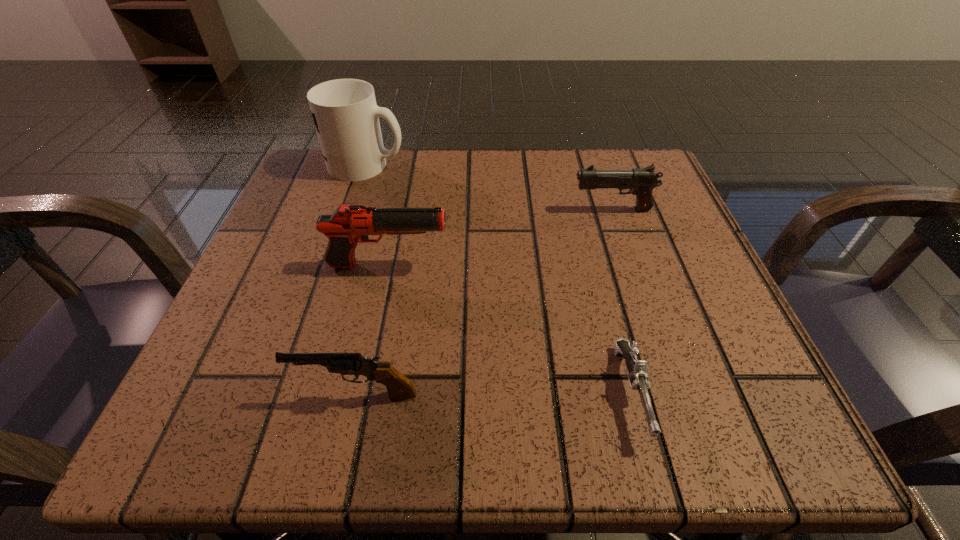
The image size is (960, 540). In order to click on the tallest object in this screenshot , I will do `click(346, 117)`.

I want to click on mug, so click(x=346, y=117).

Locate an element on the screen. This screenshot has height=540, width=960. the second farthest gun is located at coordinates (349, 225).

Identify the location of the second tallest object. (349, 225).

This screenshot has height=540, width=960. Find the location of `the fourth nearest object`. the fourth nearest object is located at coordinates (641, 182).

This screenshot has width=960, height=540. Find the location of `the shortest gun`. the shortest gun is located at coordinates (637, 369).

At what (x,y) coordinates should I click in order to perform the action: click on blank space located 0.260m on the handle side of the farthest object. Please return your answer as a coordinate pair (x, y). Looking at the image, I should click on (527, 165).

Locate an element on the screen. free space located at the aiming end of the tallest gun is located at coordinates (556, 266).

Locate an element on the screen. The width and height of the screenshot is (960, 540). vacant space situated 0.080m in the direction the fourth nearest object is aimed is located at coordinates (530, 210).

At what (x,y) coordinates should I click in order to perform the action: click on vacant region located 0.230m in the direction the fourth nearest object is aimed. Please return your answer as a coordinate pair (x, y). Looking at the image, I should click on (451, 210).